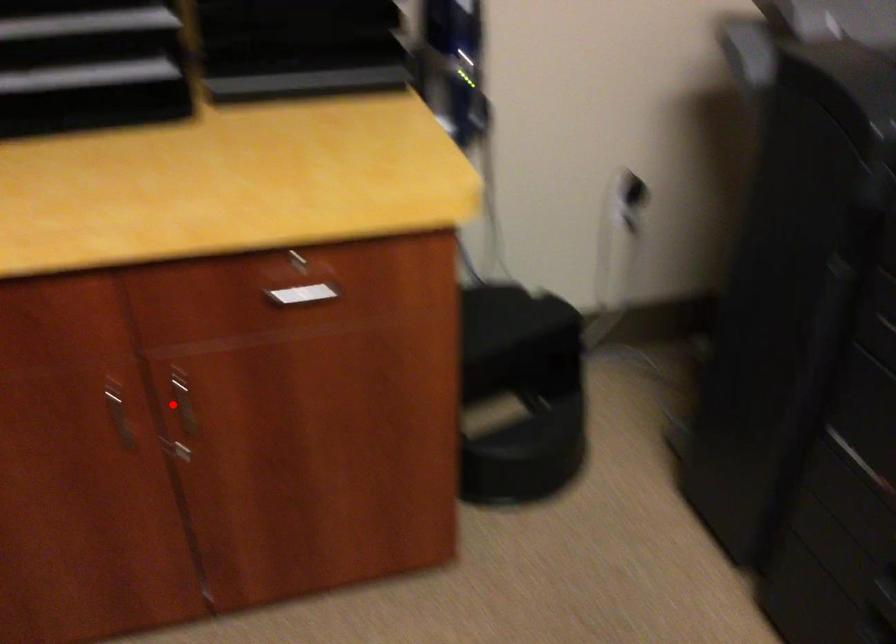
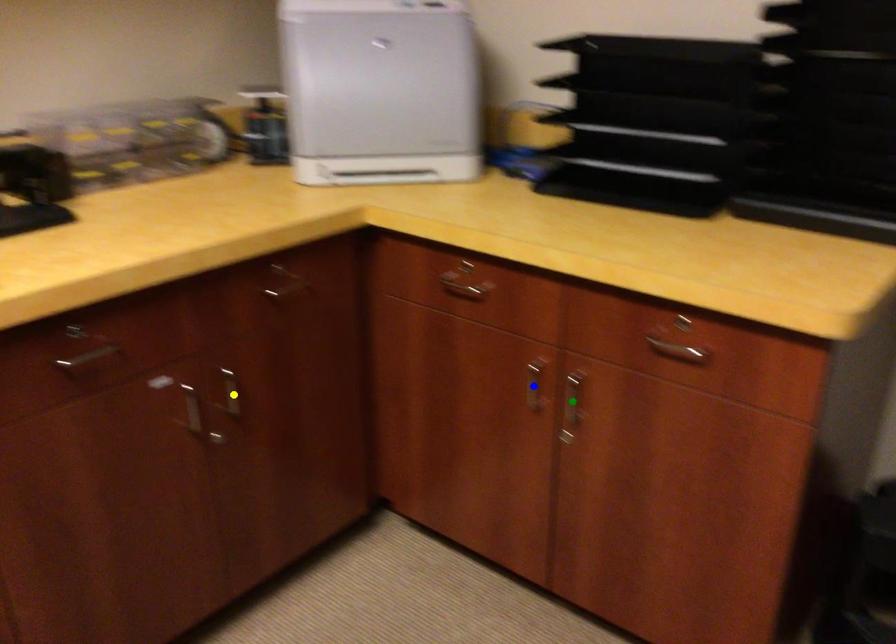
Question: I am providing you with two images of the same scene from different viewpoints. A red point is marked on the first image. You are given multiple points on the second image. Which point in image 2 is actually the same real-world point as the red point in image 1?

Choices:
 (A) blue point
 (B) yellow point
 (C) green point

Answer: (C)